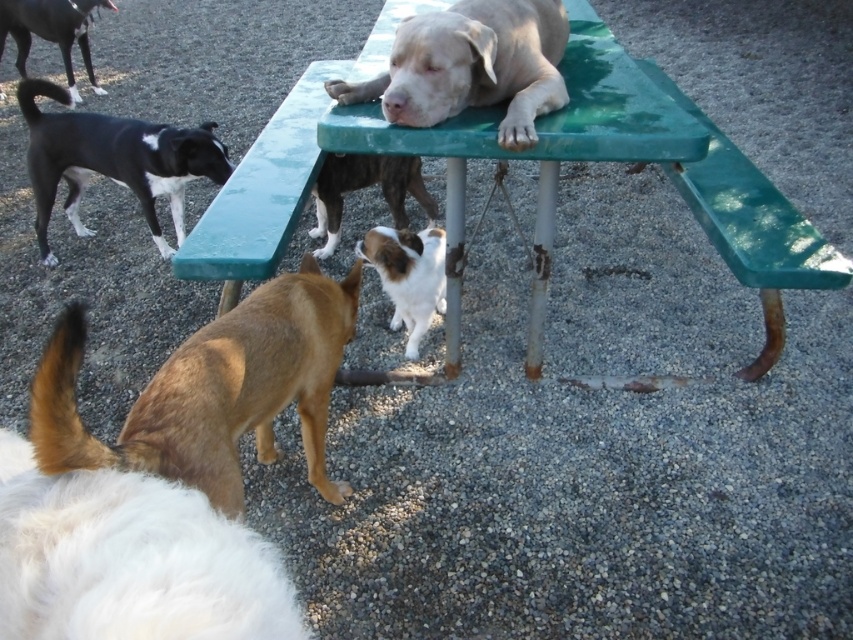
Can you confirm if white fluffy dog at lower left is thinner than brown fur dog at lower center?

In fact, white fluffy dog at lower left might be wider than brown fur dog at lower center.

Is white fluffy dog at lower left wider than brown fur dog at lower center?

Yes, white fluffy dog at lower left is wider than brown fur dog at lower center.

Is point (44, 632) farther from viewer compared to point (276, 323)?

That is False.

Locate an element on the screen. The height and width of the screenshot is (640, 853). white fluffy dog at lower left is located at coordinates (129, 560).

Between white fluffy dog at center and black and white fur at upper left, which one has more height?

Standing taller between the two is black and white fur at upper left.

Describe the element at coordinates (408, 276) in the screenshot. The height and width of the screenshot is (640, 853). I see `white fluffy dog at center` at that location.

Is point (440, 248) less distant than point (61, 4)?

Yes.

Where is `white fluffy dog at center`? Image resolution: width=853 pixels, height=640 pixels. white fluffy dog at center is located at coordinates (408, 276).

Is point (236, 412) positioned before point (39, 22)?

Yes, it is in front of point (39, 22).

Who is positioned more to the right, brown fur dog at lower center or black and white fur at upper left?

Positioned to the right is brown fur dog at lower center.

Locate an element on the screen. The image size is (853, 640). brown fur dog at lower center is located at coordinates (212, 388).

Locate an element on the screen. The height and width of the screenshot is (640, 853). brown fur dog at lower center is located at coordinates (212, 388).